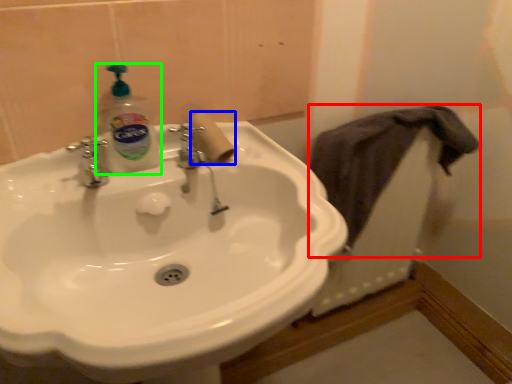
Question: Which object is positioned farthest from bath towel (highlighted by a red box)? Select from toilet paper (highlighted by a blue box) and cleaning product (highlighted by a green box).

Choices:
 (A) toilet paper
 (B) cleaning product

Answer: (B)